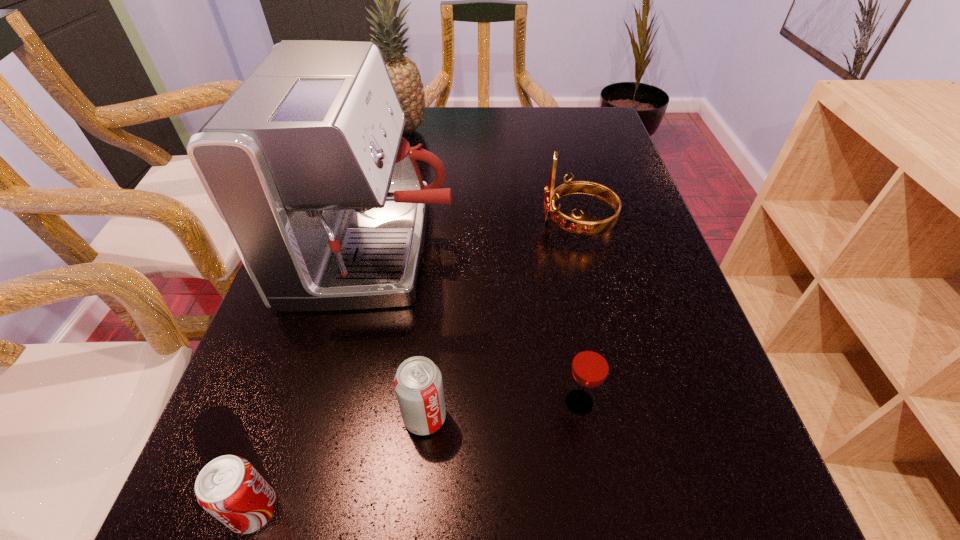
Identify the location of vacant area between the farther soda can and the nearest object. (340, 463).

The width and height of the screenshot is (960, 540). Identify the location of unoccupied position between the glass and the farthest object. (492, 267).

Find the location of a particular element. Image resolution: width=960 pixels, height=540 pixels. free space between the farthest object and the tiara is located at coordinates (491, 177).

The image size is (960, 540). I want to click on vacant area that lies between the pineapple and the glass, so coord(492,267).

Identify which object is the fifth closest to the farthest object. Please provide its 2D coordinates. Your answer should be formatted as a tuple, i.e. [(x, y)], where the tuple contains the x and y coordinates of a point satisfying the conditions above.

[(229, 488)]

Choose which object is the second nearest neighbor to the farthest object. Please provide its 2D coordinates. Your answer should be formatted as a tuple, i.e. [(x, y)], where the tuple contains the x and y coordinates of a point satisfying the conditions above.

[(575, 225)]

At what (x,y) coordinates should I click in order to perform the action: click on vacant position in the image that satisfies the following two spatial constraints: 1. on the back side of the right soda can; 2. on the right side of the glass. Please return your answer as a coordinate pair (x, y). This screenshot has height=540, width=960. Looking at the image, I should click on (426, 402).

This screenshot has width=960, height=540. I want to click on vacant region that satisfies the following two spatial constraints: 1. on the back side of the glass; 2. on the front of the coffee maker near the spout, so click(x=553, y=249).